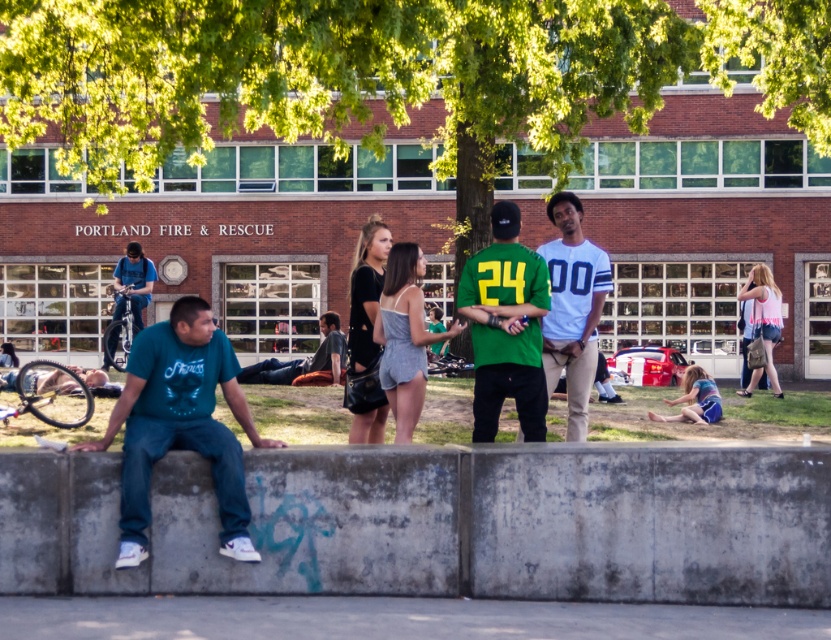
Question: Is green leafy tree at center above denim shorts at lower right?

Choices:
 (A) yes
 (B) no

Answer: (A)

Question: Which point is farther to the camera?

Choices:
 (A) (227, 451)
 (B) (394, 257)
 (C) (711, 400)
 (D) (473, 218)

Answer: (D)

Question: Is green leafy tree at center to the right of teal t-shirt at left from the viewer's perspective?

Choices:
 (A) no
 (B) yes

Answer: (B)

Question: Which of these objects is positioned farthest from the green leafy tree at center?

Choices:
 (A) green matte jersey at center
 (B) denim shorts at lower right

Answer: (A)

Question: Which object is the closest to the green leafy tree at upper center?

Choices:
 (A) denim shorts at lower right
 (B) green leafy tree at center
 (C) teal t-shirt at left

Answer: (B)

Question: Can you confirm if teal t-shirt at left is thinner than denim shorts at lower right?

Choices:
 (A) yes
 (B) no

Answer: (B)